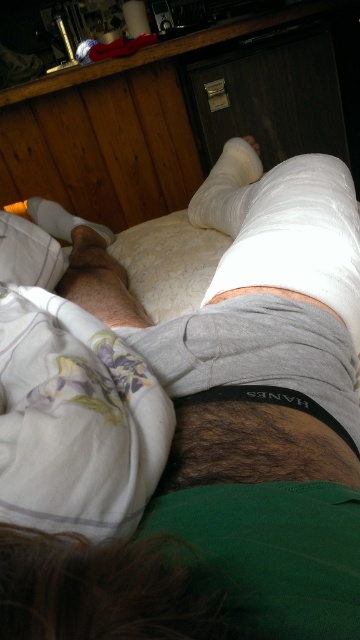
Question: Is the position of white cloth bandage at center less distant than that of white matte bandage at lower left?

Choices:
 (A) no
 (B) yes

Answer: (B)

Question: Is white cloth bandage at center positioned behind white matte bandage at lower left?

Choices:
 (A) no
 (B) yes

Answer: (A)

Question: Can you confirm if white cloth bandage at center is positioned below white matte bandage at lower left?

Choices:
 (A) no
 (B) yes

Answer: (B)

Question: Which point is closer to the camera?

Choices:
 (A) (110, 240)
 (B) (209, 193)

Answer: (B)